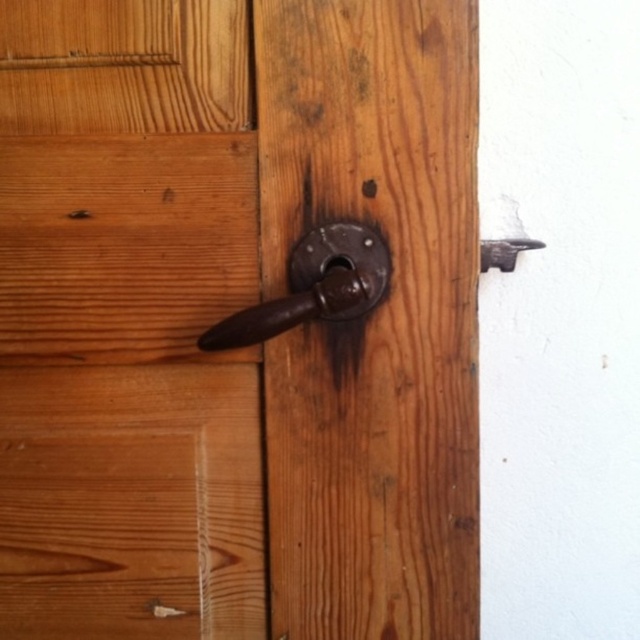
Question: Can you confirm if polished dark brown handle at center is wider than rusty metal door handle at upper right?

Choices:
 (A) yes
 (B) no

Answer: (A)

Question: Can you confirm if polished dark brown handle at center is positioned above rusty metal door handle at upper right?

Choices:
 (A) yes
 (B) no

Answer: (B)

Question: Does polished dark brown handle at center lie in front of rusty metal door handle at upper right?

Choices:
 (A) yes
 (B) no

Answer: (A)

Question: Which object is farther from the camera taking this photo?

Choices:
 (A) polished dark brown handle at center
 (B) rusty metal door handle at upper right

Answer: (B)